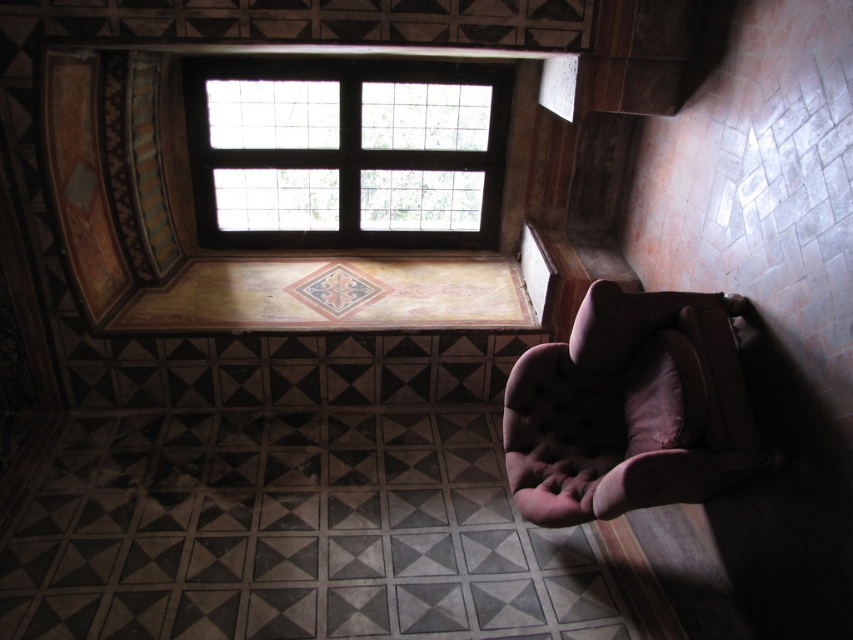
You are an interior designer planning to hang a large painting in the room. The painting must be centered exactly at the point where the wooden grid window at upper center is located. Is this possible? Please explain based on the room layout described.

The wooden grid window at upper center is already located at the point (345,150), so it is possible to center the painting there as the coordinates are specified.

You are sitting in the velvet brown armchair at lower right and looking up. Which direction should you turn your head to see the wooden grid window at upper center?

The wooden grid window at upper center is to the left of the velvet brown armchair at lower right, so you should turn your head to the left to see it.

You are a delivery person who needs to place a package on a table that is exactly 2 meters away from the velvet brown armchair at lower right. Is the wooden grid window at upper center a good reference point for placing the table?

The wooden grid window at upper center is 2.05 meters away from the velvet brown armchair at lower right. Since the required distance is 2 meters, the window is very close to the desired distance, so it can be used as a reference point for placing the table.